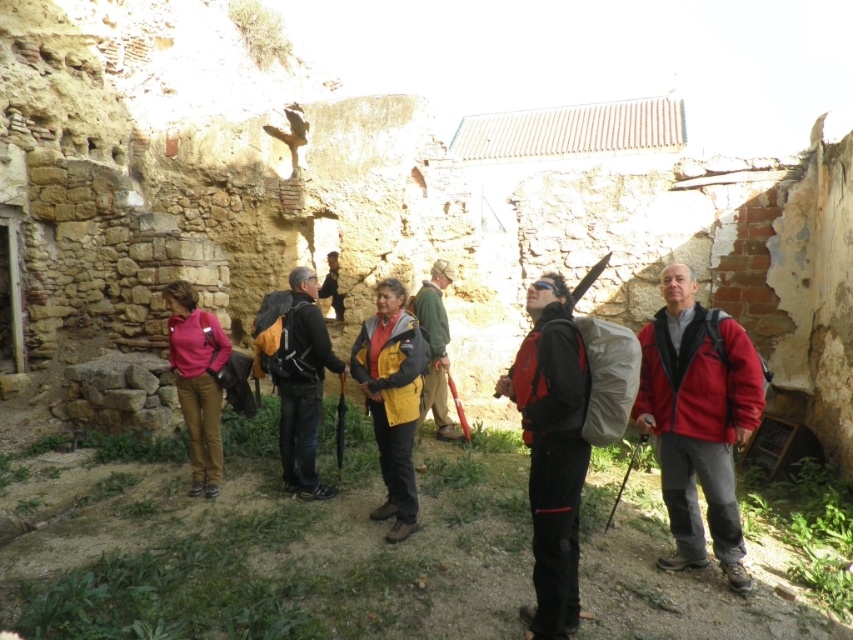
Looking at this image, you are standing at the entrance of the stone structure and see the matte black backpack at center. If you walk straight ahead, will you reach the backpack before the end of the structure?

The position of matte black backpack at center is at point (297, 376), so yes, you will reach the backpack before the end of the structure.

You are a hiker who just arrived at this historical site. You need to place your matte black backpack at center and green fabric jacket at center on the ground. Since the ground is uneven, you want to ensure they won not roll away. Which object is more likely to stay in place due to its height?

The matte black backpack at center is much taller than the green fabric jacket at center, so it has a lower center of gravity and is more stable, making it less likely to roll away on uneven ground.